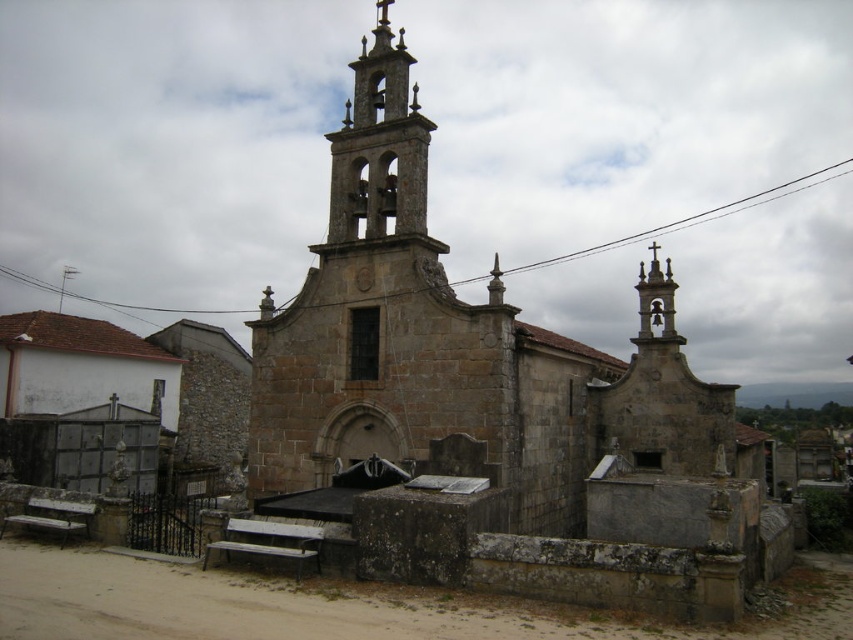
Between point (498, 444) and point (403, 32), which one is positioned in front?

Point (498, 444) is in front.

Describe the element at coordinates (376, 310) in the screenshot. I see `stone bell tower at center` at that location.

Which is behind, point (432, 408) or point (376, 193)?

Positioned behind is point (376, 193).

This screenshot has height=640, width=853. I want to click on stone bell tower at center, so click(x=376, y=310).